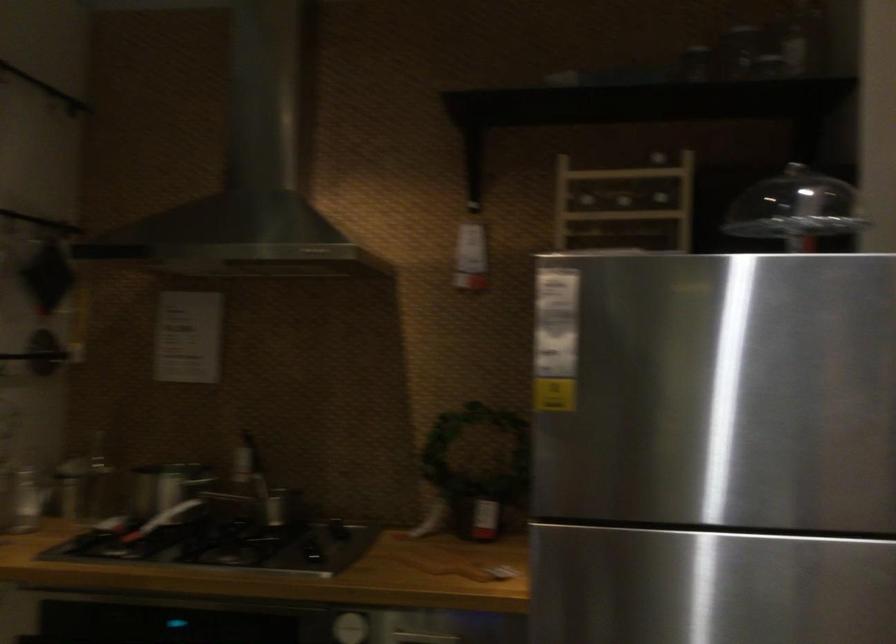
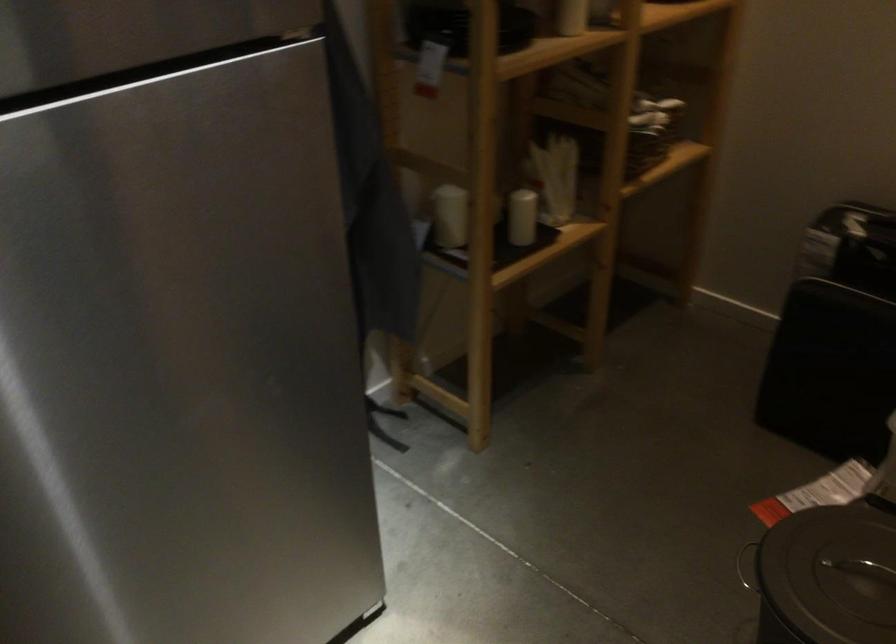
First-person continuous shooting, in which direction is the camera rotating?

The camera's rotation is toward right-down.